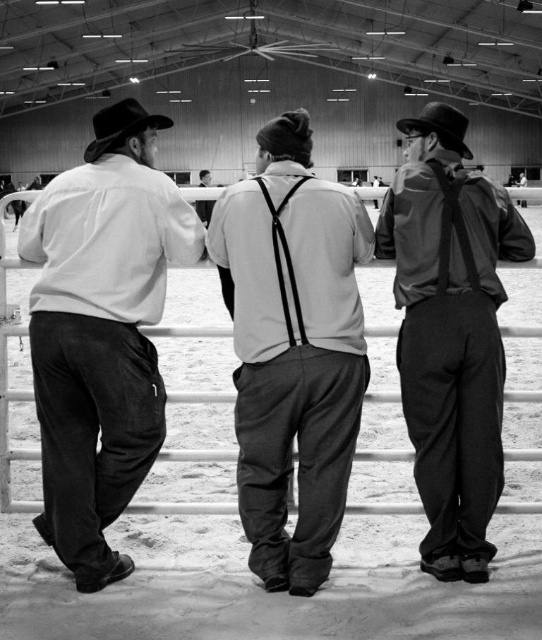
Is point (94, 113) behind point (408, 125)?

That is True.

From the picture: Does rustic leather cowboy hat at center have a smaller size compared to black felt cowboy hat at upper right?

Incorrect, rustic leather cowboy hat at center is not smaller in size than black felt cowboy hat at upper right.

Is point (127, 124) closer to camera compared to point (454, 132)?

Yes, it is.

You are a GUI agent. You are given a task and a screenshot of the screen. Output one action in this format:
    pyautogui.click(x=<x>, y=<y>)
    Task: Click on the rustic leather cowboy hat at center
    Image resolution: width=542 pixels, height=640 pixels.
    Given the screenshot: What is the action you would take?
    pyautogui.click(x=120, y=125)

Is the position of light gray cotton shirt at center more distant than that of rustic leather cowboy hat at center?

That is False.

Between light gray cotton shirt at center and rustic leather cowboy hat at center, which one has more height?

light gray cotton shirt at center is taller.

Is point (261, 216) less distant than point (125, 132)?

Yes, point (261, 216) is closer to viewer.

Identify the location of light gray cotton shirt at center. The image size is (542, 640). (293, 348).

Can you confirm if light gray cotton shirt at center is thinner than black felt cowboy hat at upper right?

Yes, light gray cotton shirt at center is thinner than black felt cowboy hat at upper right.

What do you see at coordinates (293, 348) in the screenshot? This screenshot has height=640, width=542. I see `light gray cotton shirt at center` at bounding box center [293, 348].

Locate an element on the screen. light gray cotton shirt at center is located at coordinates (293, 348).